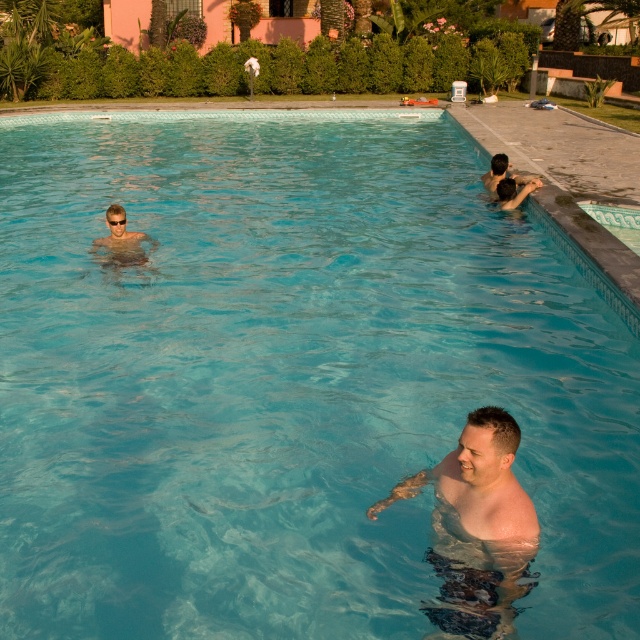
Question: Is shiny skin man at center to the right of transparent plastic goggles at upper left from the viewer's perspective?

Choices:
 (A) yes
 (B) no

Answer: (A)

Question: Does shiny skin man at center have a smaller size compared to transparent plastic goggles at upper left?

Choices:
 (A) yes
 (B) no

Answer: (B)

Question: From the image, what is the correct spatial relationship of shiny skin man at center in relation to transparent plastic goggles at upper left?

Choices:
 (A) above
 (B) below

Answer: (B)

Question: Which of the following is the farthest from the observer?

Choices:
 (A) (122, 221)
 (B) (442, 540)

Answer: (A)

Question: Which of the following is the farthest from the observer?

Choices:
 (A) (490, 516)
 (B) (116, 227)

Answer: (B)